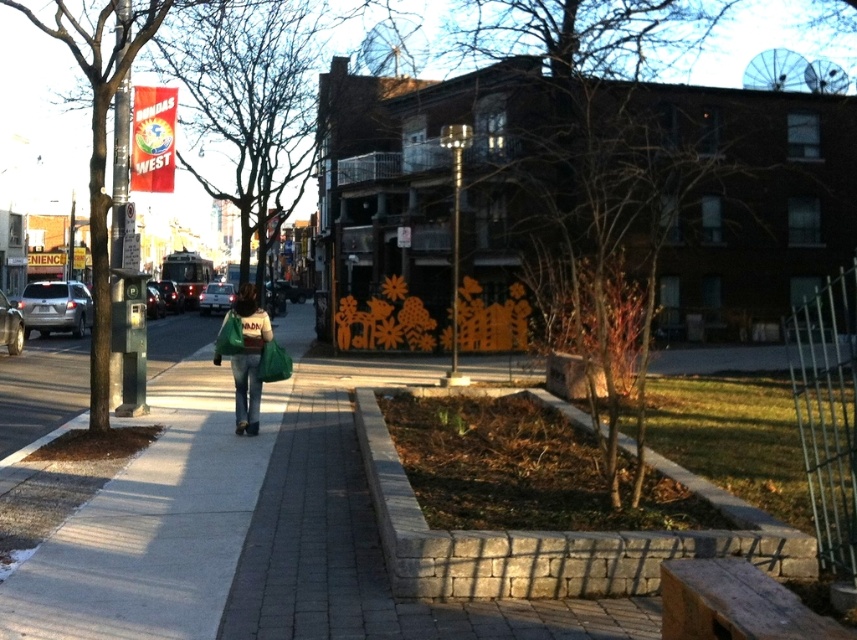
You are a delivery person who needs to deliver a package to the person walking away. You see the green fabric bag at center and the green fabric jacket at center. Which item is located to the left of the other?

The green fabric bag at center is positioned on the left side of the green fabric jacket at center.

You are standing on the gray concrete sidewalk at center and see the green fabric jacket at center. Which direction should you walk to move towards the street?

Since the gray concrete sidewalk at center is on the left side of the green fabric jacket at center, you should walk to the right to move towards the street.